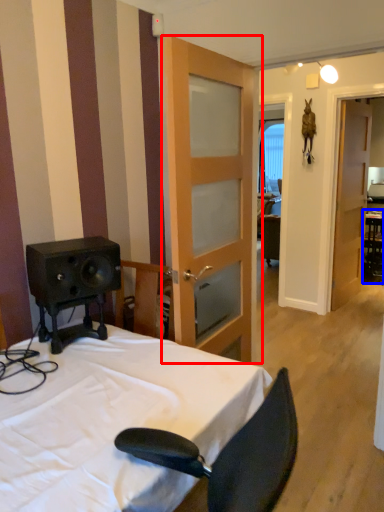
Question: Which object appears farthest to the camera in this image, door (highlighted by a red box) or table (highlighted by a blue box)?

Choices:
 (A) door
 (B) table

Answer: (B)